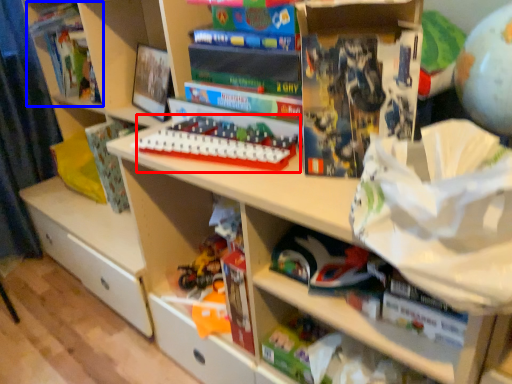
Question: Which object appears closest to the camera in this image, toy (highlighted by a red box) or book (highlighted by a blue box)?

Choices:
 (A) toy
 (B) book

Answer: (A)